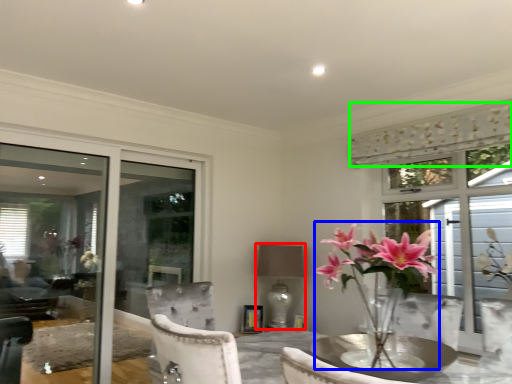
Question: Considering the real-world distances, which object is closest to lamp (highlighted by a red box)? floral arrangement (highlighted by a blue box) or curtain (highlighted by a green box).

Choices:
 (A) floral arrangement
 (B) curtain

Answer: (A)